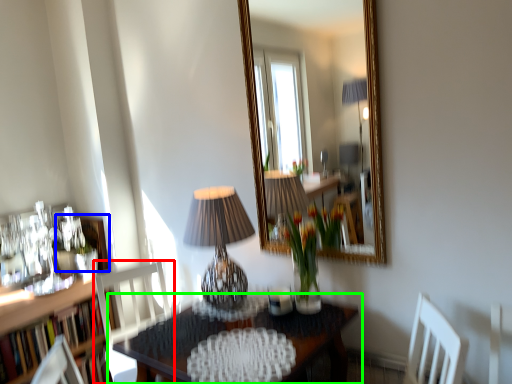
Question: Which object is the farthest from chair (highlighted by a red box)? Choose among these: picture frame (highlighted by a blue box) or table (highlighted by a green box).

Choices:
 (A) picture frame
 (B) table

Answer: (B)